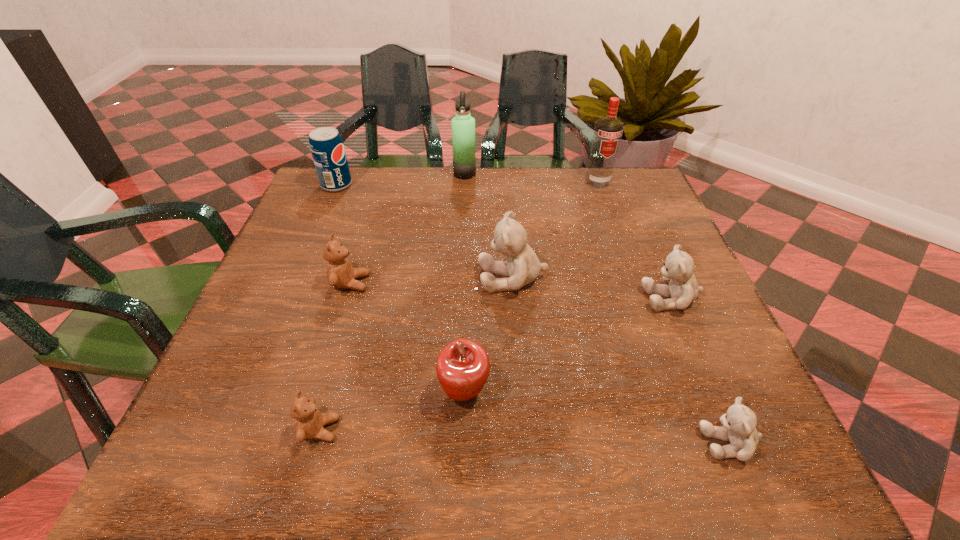
The width and height of the screenshot is (960, 540). What are the coordinates of `vacant area between the apple and the blue pop` in the screenshot? It's located at pyautogui.click(x=400, y=288).

Locate an element on the screen. free space between the thermos bottle and the tallest teddy bear is located at coordinates (489, 226).

This screenshot has height=540, width=960. I want to click on free area in between the leftmost object and the farther brown teddy bear, so click(344, 234).

At what (x,y) coordinates should I click in order to perform the action: click on free spot between the pop and the tallest teddy bear. Please return your answer as a coordinate pair (x, y). Image resolution: width=960 pixels, height=540 pixels. Looking at the image, I should click on (424, 231).

At what (x,y) coordinates should I click in order to perform the action: click on unoccupied position between the farther brown teddy bear and the pop. Please return your answer as a coordinate pair (x, y). The height and width of the screenshot is (540, 960). Looking at the image, I should click on point(344,234).

You are a GUI agent. You are given a task and a screenshot of the screen. Output one action in this format:
    pyautogui.click(x=<x>, y=<y>)
    Task: Click on the free spot between the thermos bottle and the nearer brown teddy bear
    This screenshot has width=960, height=540.
    Given the screenshot: What is the action you would take?
    pyautogui.click(x=393, y=301)

I want to click on vacant region between the smaller brown teddy bear and the farther brown teddy bear, so click(x=335, y=356).

The image size is (960, 540). I want to click on vacant area that lies between the apple and the nearer brown teddy bear, so click(393, 410).

Where is `empty location between the vodka and the third teddy bear from right to left`? empty location between the vodka and the third teddy bear from right to left is located at coordinates (555, 230).

Identify which object is the nearest to the vodka. Please provide its 2D coordinates. Your answer should be formatted as a tuple, i.e. [(x, y)], where the tuple contains the x and y coordinates of a point satisfying the conditions above.

[(463, 125)]